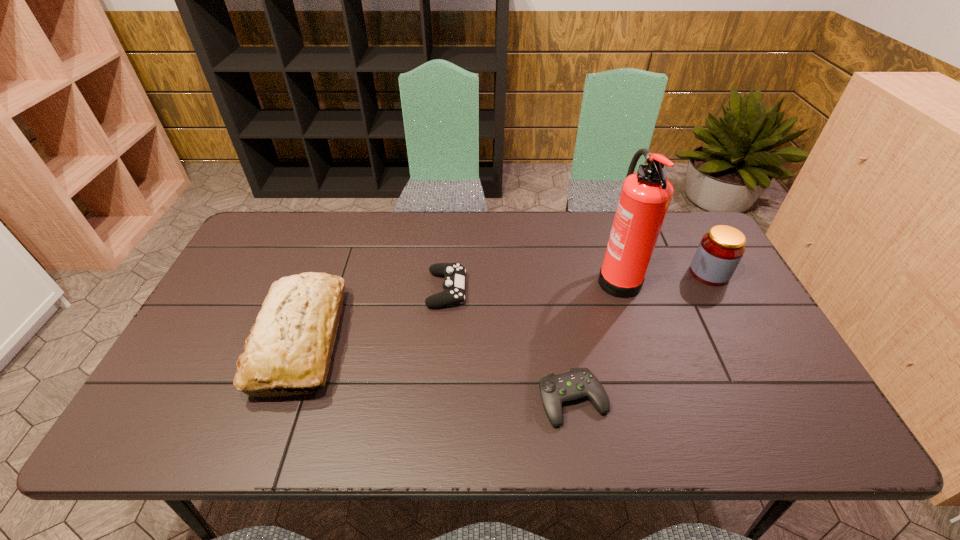
This screenshot has width=960, height=540. What are the coordinates of `fire extinguisher` in the screenshot? It's located at (645, 196).

Where is `the tallest object`? This screenshot has width=960, height=540. the tallest object is located at coordinates (645, 196).

The height and width of the screenshot is (540, 960). What are the coordinates of `the rightmost object` in the screenshot? It's located at (720, 250).

At what (x,y) coordinates should I click in order to perform the action: click on the leftmost object. Please return your answer as a coordinate pair (x, y). The width and height of the screenshot is (960, 540). Looking at the image, I should click on (290, 345).

You are a GUI agent. You are given a task and a screenshot of the screen. Output one action in this format:
    pyautogui.click(x=<x>, y=<y>)
    Task: Click on the second object from left to right
    This screenshot has width=960, height=540.
    Given the screenshot: What is the action you would take?
    pyautogui.click(x=454, y=283)

What are the coordinates of `the left control` in the screenshot? It's located at (454, 283).

At what (x,y) coordinates should I click in order to perform the action: click on the right control. Please return your answer as a coordinate pair (x, y). Image resolution: width=960 pixels, height=540 pixels. Looking at the image, I should click on (555, 389).

Find the location of `the shorter control`. the shorter control is located at coordinates (555, 389).

Where is `free space located at the nozzle of the tallest object`? The image size is (960, 540). free space located at the nozzle of the tallest object is located at coordinates click(x=517, y=276).

Locate an element on the screen. Image resolution: width=960 pixels, height=540 pixels. vacant space positioned 0.290m at the nozzle of the tallest object is located at coordinates [x=501, y=276].